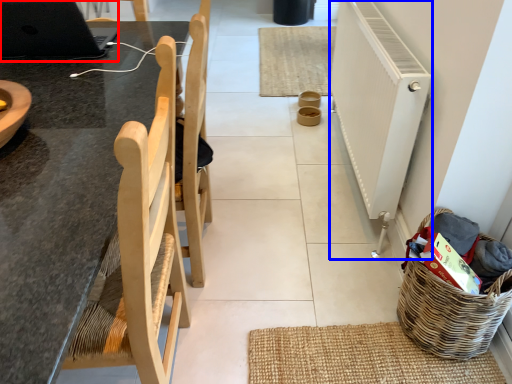
Question: Which point is closer to the camera, laptop (highlighted by a red box) or radiator (highlighted by a blue box)?

Choices:
 (A) laptop
 (B) radiator

Answer: (A)